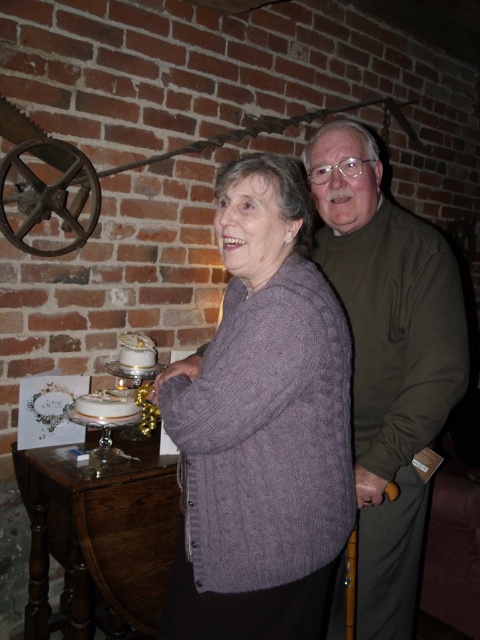
You are a baker who needs to choose the bigger cake between the white glossy cake at lower left and the white frosted cake at center for a customer. Which one should you select?

The white glossy cake at lower left is larger in size than the white frosted cake at center, so you should select the white glossy cake at lower left.